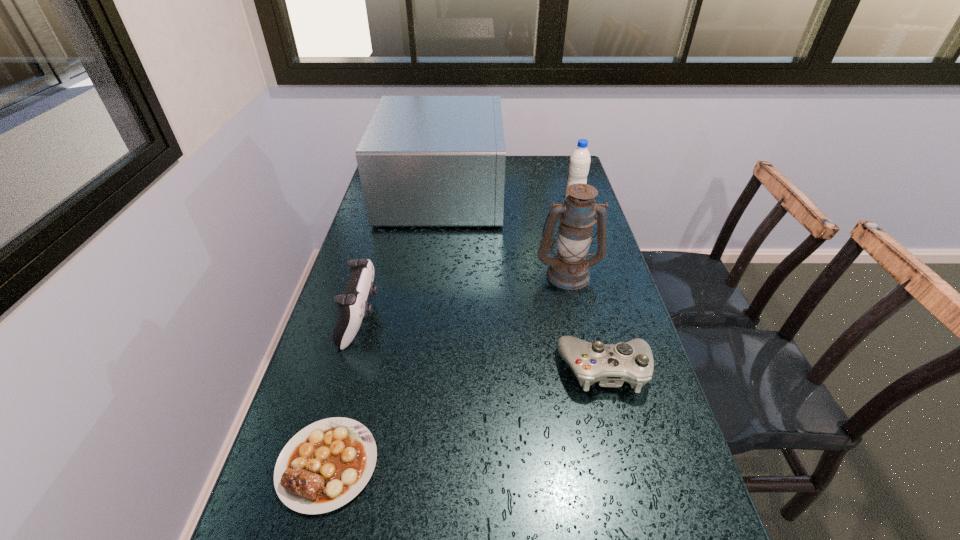
This screenshot has width=960, height=540. What are the coordinates of `vacant space that satisfies the following two spatial constraints: 1. with the door open on the shorter control; 2. on the right side of the microwave oven` in the screenshot? It's located at (420, 370).

Find the location of `free space that satisfies the following two spatial constraints: 1. with the door open on the fourth shortest object; 2. on the right side of the microwave oven`. free space that satisfies the following two spatial constraints: 1. with the door open on the fourth shortest object; 2. on the right side of the microwave oven is located at coordinates (442, 202).

Where is `free location that satisfies the following two spatial constraints: 1. on the front side of the right control; 2. on the left side of the oil lamp`? This screenshot has width=960, height=540. free location that satisfies the following two spatial constraints: 1. on the front side of the right control; 2. on the left side of the oil lamp is located at coordinates (590, 370).

The image size is (960, 540). Identify the location of vacant space that satisfies the following two spatial constraints: 1. on the back side of the third tallest object; 2. with the door open on the microwave oven. (571, 193).

I want to click on vacant region that satisfies the following two spatial constraints: 1. on the back side of the second shortest object; 2. on the front-facing side of the taller control, so click(591, 319).